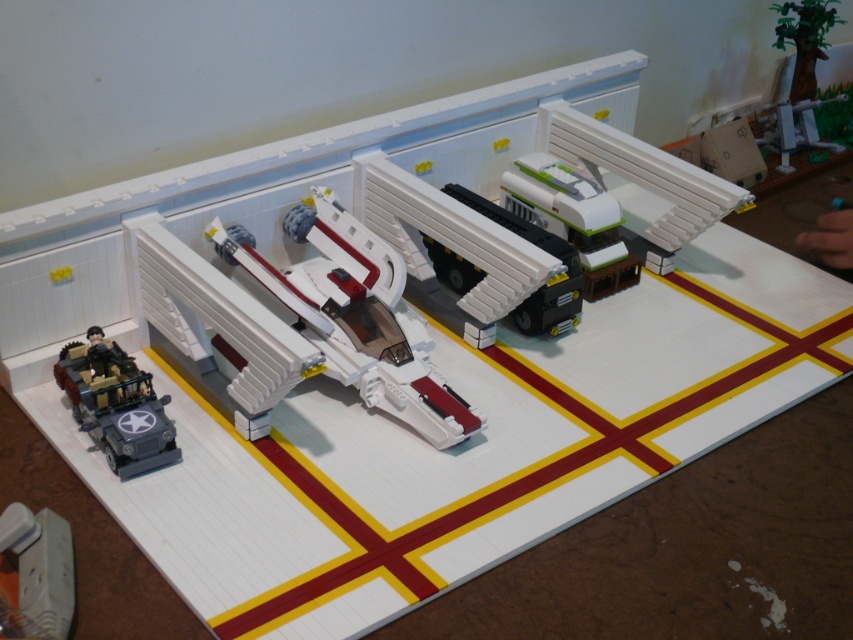
You are a small LEGO figure standing on the white baseplate with red and yellow cross patterns. You want to climb onto the white plastic spaceship at center from the matte gray military jeep at lower left. Is the spaceship higher than the jeep?

The white plastic spaceship at center is taller than the matte gray military jeep at lower left, so yes, the spaceship is higher than the jeep.

You are a LEGO builder examining the diorama. You notice the matte gray military jeep at lower left and the white plastic plug at lower left. Which object is positioned to the right of the other?

The matte gray military jeep at lower left is to the right of the white plastic plug at lower left.

You are a character in the LEGO diorama who needs to move from the matte gray military jeep at lower left to the white plastic spaceship at center. Which direction should you head to reach the spaceship?

You should head to the right to reach the white plastic spaceship at center since it is located to the right of the matte gray military jeep at lower left.